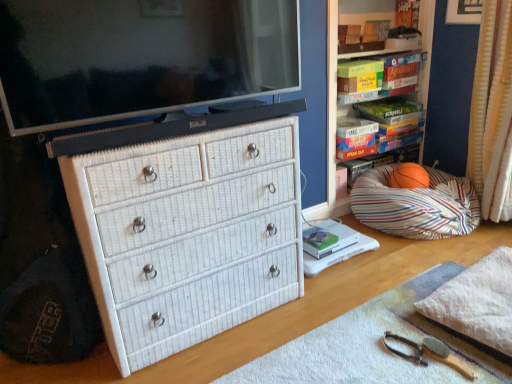
The height and width of the screenshot is (384, 512). I want to click on vacant area that is in front of striped fabric bean bag at right, so click(405, 264).